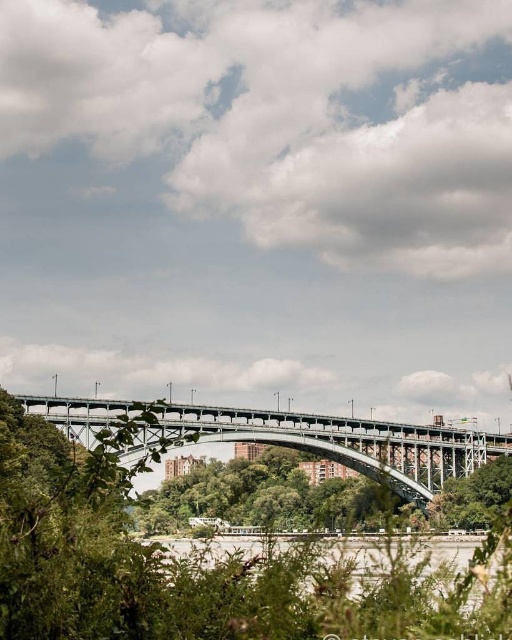
Question: Can you confirm if green leafy tree at center is positioned below gray concrete river at center?

Choices:
 (A) no
 (B) yes

Answer: (A)

Question: Is green leafy tree at center wider than metallic gray bridge at center?

Choices:
 (A) yes
 (B) no

Answer: (B)

Question: Which point appears farthest from the camera in this image?

Choices:
 (A) (402, 628)
 (B) (253, 579)
 (C) (189, 436)

Answer: (C)

Question: Which of the following is the closest to the observer?

Choices:
 (A) gray concrete river at center
 (B) green leafy tree at center
 (C) metallic gray bridge at center

Answer: (B)

Question: Which point is closer to the camera?

Choices:
 (A) metallic gray bridge at center
 (B) gray concrete river at center

Answer: (B)

Question: Does green leafy tree at center appear under metallic gray bridge at center?

Choices:
 (A) yes
 (B) no

Answer: (A)